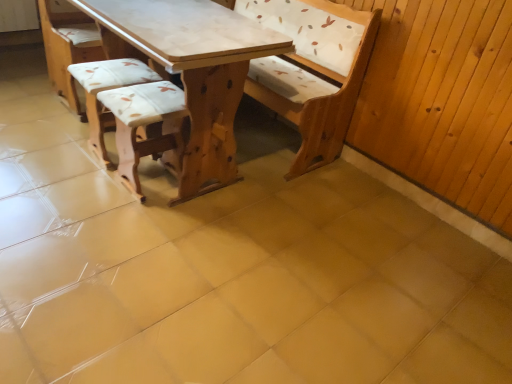
This screenshot has width=512, height=384. I want to click on vacant area to the right of light brown wood table at center, so click(315, 217).